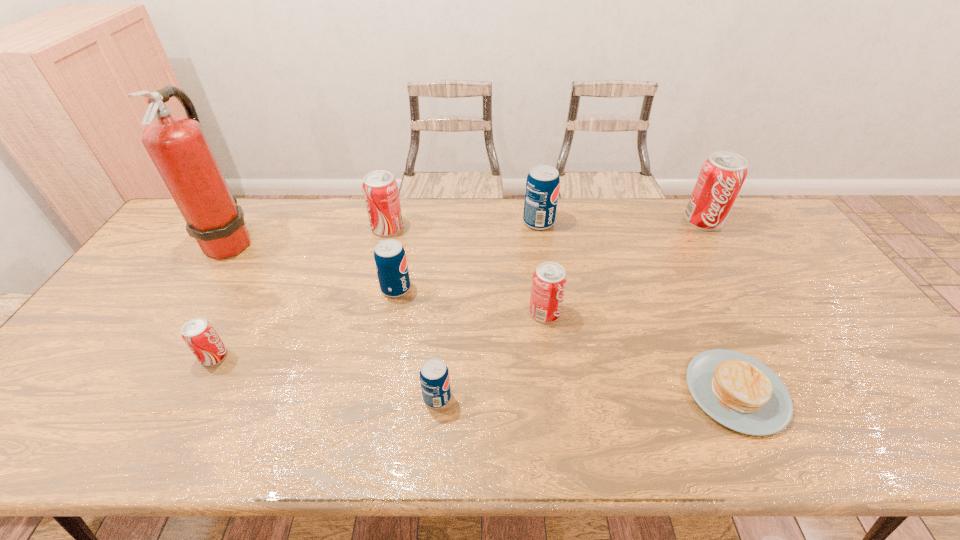
The width and height of the screenshot is (960, 540). In the image, there is a desktop. Identify the location of vacant space at the near edge. pyautogui.click(x=473, y=443).

Identify the location of free space at the left edge of the desktop. This screenshot has height=540, width=960. (136, 347).

The image size is (960, 540). Find the location of `vacant region at the right edge of the desktop`. vacant region at the right edge of the desktop is located at coordinates (846, 338).

Image resolution: width=960 pixels, height=540 pixels. Identify the location of free location at the near right corner. (908, 419).

At what (x,y) coordinates should I click in order to perform the action: click on free space between the nearest pop and the fifth farthest pop. Please return your answer as a coordinate pair (x, y). Looking at the image, I should click on (491, 355).

Find the location of a particular element. The width and height of the screenshot is (960, 540). free spot between the rightmost blue pop and the second biggest blue pop is located at coordinates (468, 255).

The width and height of the screenshot is (960, 540). I want to click on free spot between the tallest pop and the fifth farthest pop, so click(624, 267).

Identify the location of free space between the fourth pop from right to left and the second nearest red soda can. This screenshot has height=540, width=960. point(491,355).

The height and width of the screenshot is (540, 960). I want to click on unoccupied position between the third biggest red soda can and the smallest blue pop, so click(491, 355).

You are a GUI agent. You are given a task and a screenshot of the screen. Output one action in this format:
    pyautogui.click(x=<x>, y=<y>)
    Task: Click on the vacant area between the pancake and the tallest pop
    
    Given the screenshot: What is the action you would take?
    pyautogui.click(x=720, y=306)